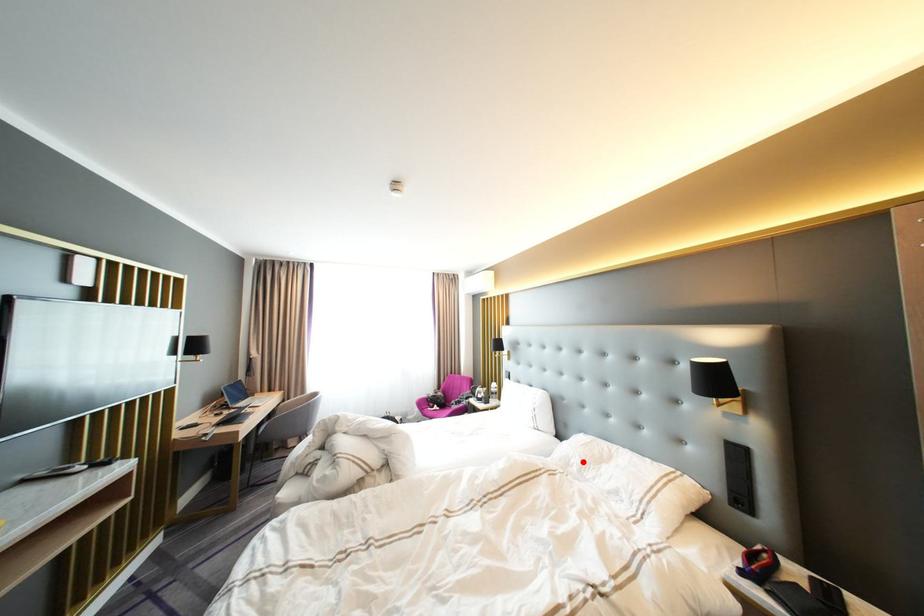
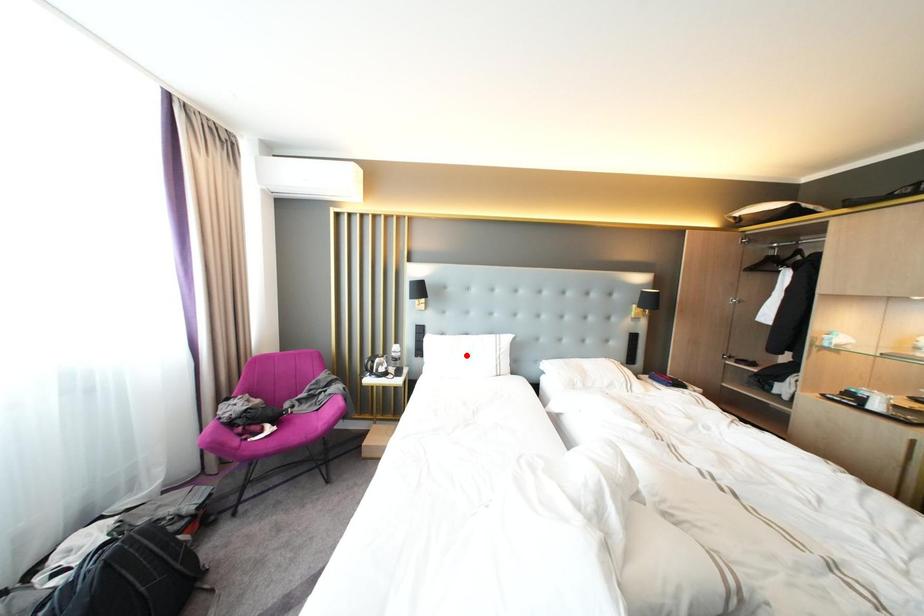
I am providing you with two images of the same scene from different viewpoints. A red point is marked on the first image and another point is marked on the second image. Do the highlighted points in image1 and image2 indicate the same real-world spot?

No